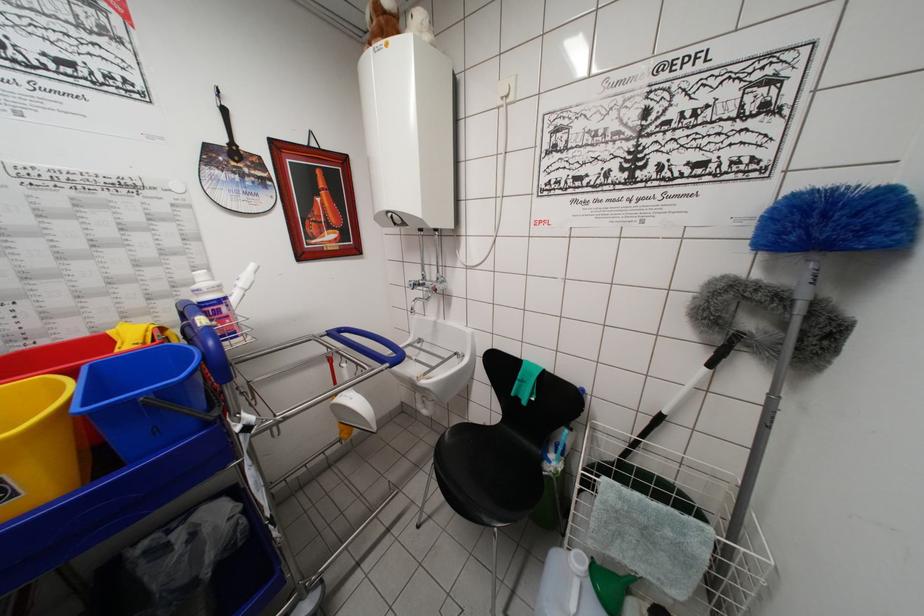
What do you see at coordinates (452, 280) in the screenshot? I see `the dispenser pump` at bounding box center [452, 280].